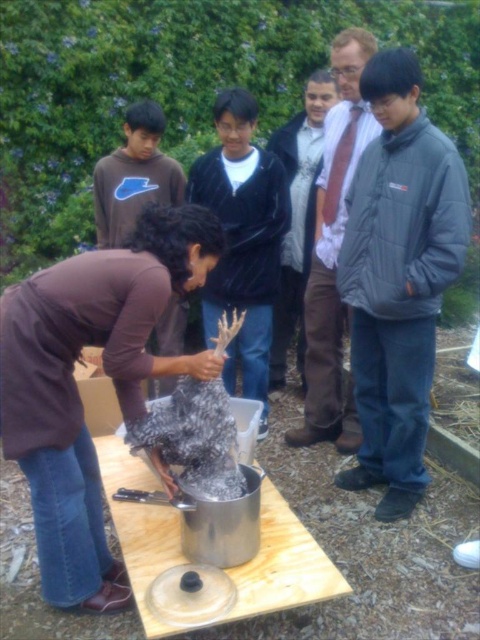
Is plywood picnic table at center closer to the viewer compared to brown leather jacket at upper center?

Yes, plywood picnic table at center is in front of brown leather jacket at upper center.

Is plywood picnic table at center behind brown leather jacket at upper center?

No, plywood picnic table at center is in front of brown leather jacket at upper center.

Between point (291, 595) and point (365, 58), which one is positioned in front?

Point (291, 595) is in front.

I want to click on plywood picnic table at center, so click(x=284, y=564).

Can you confirm if plywood picnic table at center is bigger than shiny silver pot at center?

Indeed, plywood picnic table at center has a larger size compared to shiny silver pot at center.

Which is in front, point (120, 522) or point (171, 435)?

Point (171, 435) is in front.

The height and width of the screenshot is (640, 480). What are the coordinates of `plywood picnic table at center` in the screenshot? It's located at tap(284, 564).

Where is `brown leather jacket at upper center`? brown leather jacket at upper center is located at coordinates (334, 252).

Does brown leather jacket at upper center appear over brown soft sweater at center?

No.

Locate an element on the screen. Image resolution: width=480 pixels, height=640 pixels. brown leather jacket at upper center is located at coordinates (x=334, y=252).

The image size is (480, 640). I want to click on brown leather jacket at upper center, so click(334, 252).